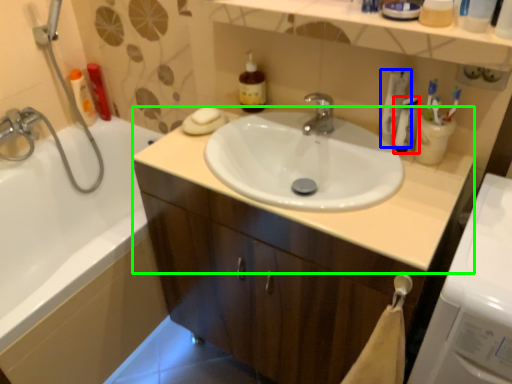
Question: Which object is the farthest from mouthwash (highlighted by a red box)? Choose among these: toothpaste (highlighted by a blue box) or counter top (highlighted by a green box).

Choices:
 (A) toothpaste
 (B) counter top

Answer: (B)